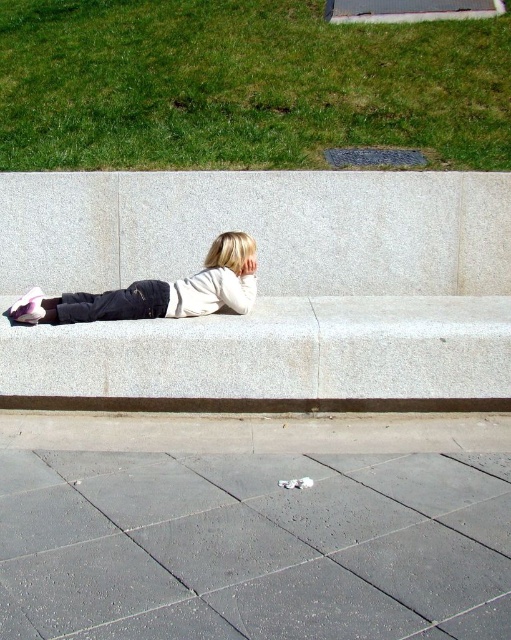
You are a delivery person trying to place a large box on the ground near the child. The box requires a surface that can accommodate its size. Based on the scene, which object between the gray concrete pavement at lower center and the brown textured curb at lower center would be more suitable for placing the box?

The gray concrete pavement at lower center has a larger size compared to the brown textured curb at lower center, so it would be more suitable for placing the large box.

You are a delivery person trying to place a package on the gray concrete pavement at lower center. However, there is a brown textured curb at lower center in the way. Can you place the package on the pavement without moving the curb?

The gray concrete pavement at lower center is located below the brown textured curb at lower center, so the curb is blocking access to the pavement. You cannot place the package there without moving the curb.